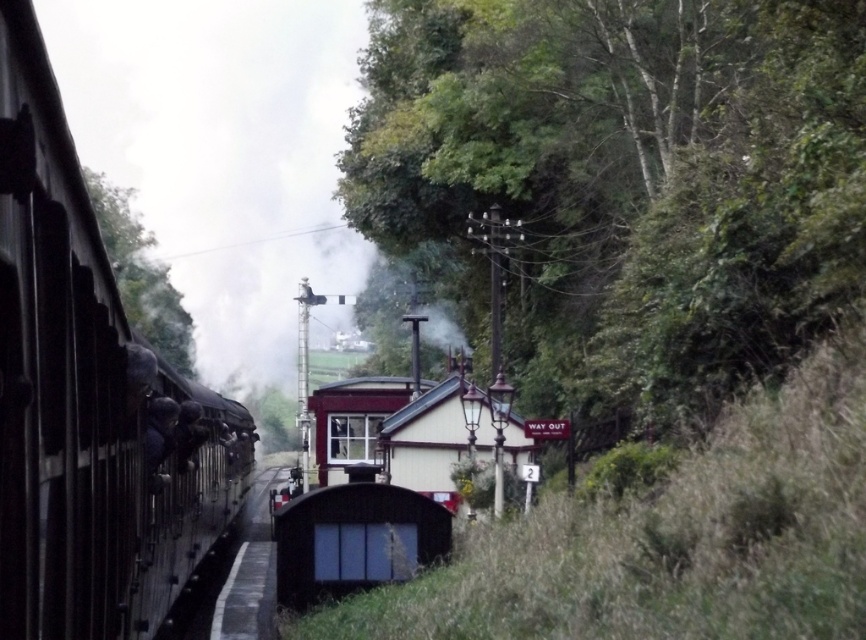
Question: Which of the following is the farthest from the observer?

Choices:
 (A) (113, 259)
 (B) (548, 365)

Answer: (A)

Question: Which of these objects is positioned farthest from the green leafy tree at upper center?

Choices:
 (A) polished metal train at left
 (B) green leafy tree at left

Answer: (B)

Question: Observing the image, what is the correct spatial positioning of polished metal train at left in reference to green leafy tree at left?

Choices:
 (A) below
 (B) above

Answer: (A)

Question: Can you confirm if green leafy tree at upper center is wider than green leafy tree at left?

Choices:
 (A) yes
 (B) no

Answer: (B)

Question: Which object appears farthest from the camera in this image?

Choices:
 (A) green leafy tree at upper center
 (B) polished metal train at left
 (C) green leafy tree at left

Answer: (C)

Question: Does green leafy tree at upper center have a lesser width compared to polished metal train at left?

Choices:
 (A) no
 (B) yes

Answer: (A)